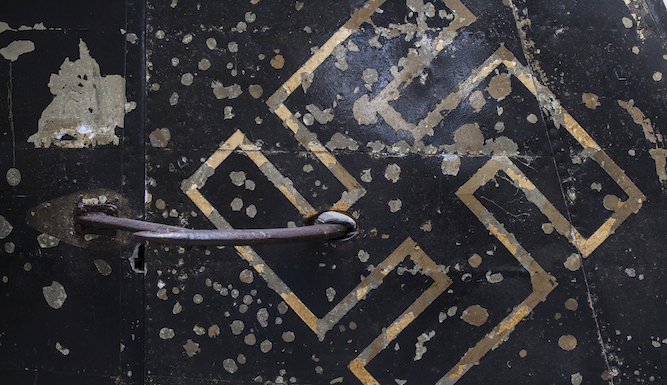
The height and width of the screenshot is (385, 667). Find the location of `door handle`. door handle is located at coordinates (203, 233).